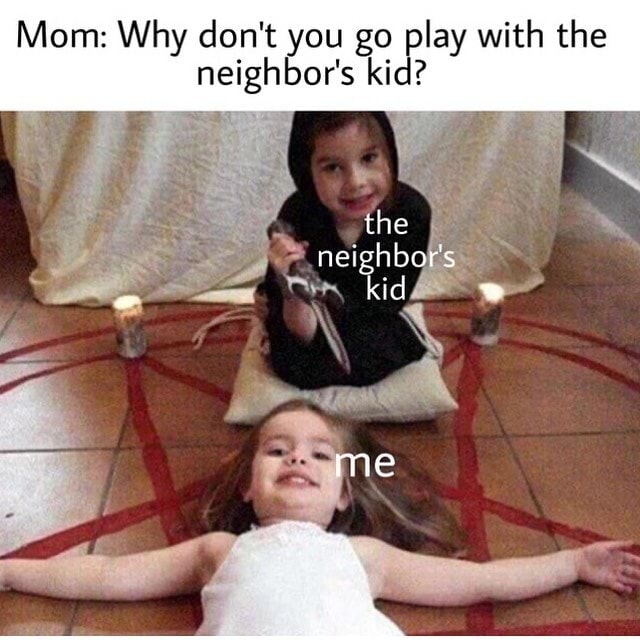
The image size is (640, 640). In order to click on wall in this screenshot , I will do `click(621, 143)`.